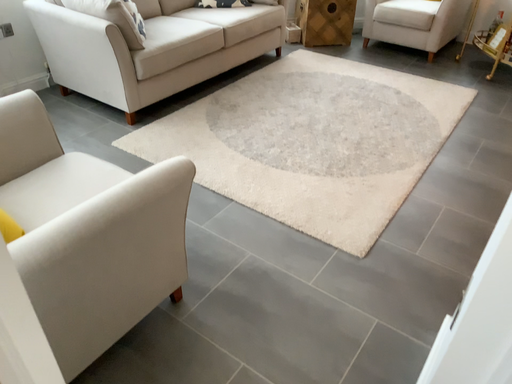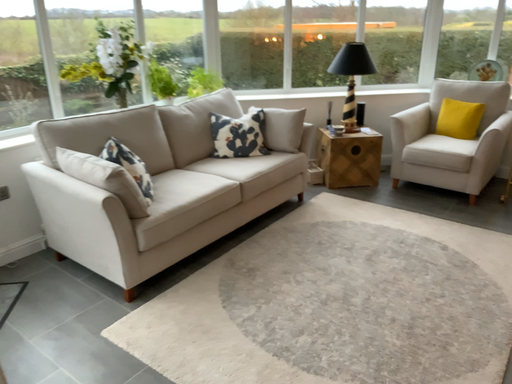
Question: How did the camera likely rotate when shooting the video?

Choices:
 (A) rotated downward
 (B) rotated upward

Answer: (B)